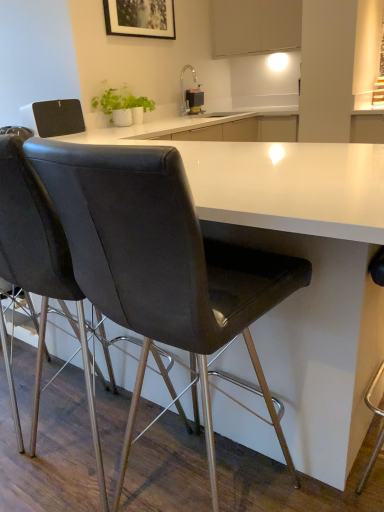
Question: Is matte black picture frame at upper center taller or shorter than white matte cabinet at upper center?

Choices:
 (A) tall
 (B) short

Answer: (B)

Question: Does point (129, 30) appear closer or farther from the camera than point (218, 26)?

Choices:
 (A) farther
 (B) closer

Answer: (B)

Question: Which object is positioned farthest from the white textured vase at upper center?

Choices:
 (A) white matte cabinet at upper center
 (B) matte black chair at center, the 1th chair positioned from the right
 (C) metallic black soap dispenser at upper center
 (D) matte black picture frame at upper center
 (E) matte black chair at center, the 2th chair from the right

Answer: (B)

Question: Based on their relative distances, which object is nearer to the matte black chair at center, the first chair positioned from the left?

Choices:
 (A) matte black chair at center, the 1th chair positioned from the right
 (B) white matte cabinet at upper center
 (C) metallic black soap dispenser at upper center
 (D) white textured vase at upper center
 (E) matte black picture frame at upper center

Answer: (A)